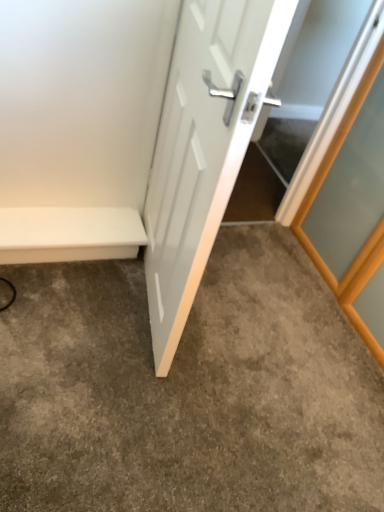
Identify the location of free spot to the right of white matte bench at lower left. point(131,293).